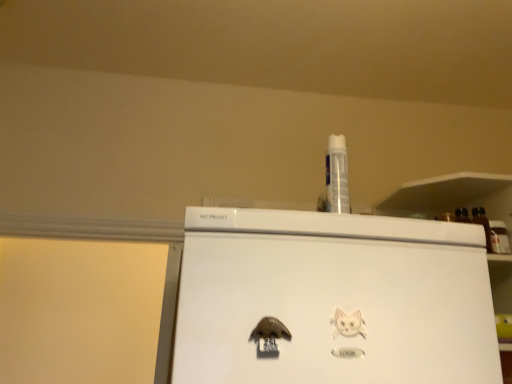
Question: Considering the positions of white paper cat at lower right, which ranks as the 2th animal in left-to-right order, and brown matte magnet at lower center, which is counted as the 1th animal, starting from the left, in the image, is white paper cat at lower right, which ranks as the 2th animal in left-to-right order, wider or thinner than brown matte magnet at lower center, which is counted as the 1th animal, starting from the left,?

Choices:
 (A) thin
 (B) wide

Answer: (A)

Question: Choose the correct answer: Is white paper cat at lower right, which ranks as the 2th animal in left-to-right order, inside brown matte magnet at lower center, which is counted as the 1th animal, starting from the left, or outside it?

Choices:
 (A) outside
 (B) inside

Answer: (A)

Question: Is white paper cat at lower right, which is the first animal from right to left, in front of or behind brown matte magnet at lower center, acting as the second animal starting from the right, in the image?

Choices:
 (A) front
 (B) behind

Answer: (B)

Question: Considering the positions of brown matte magnet at lower center, acting as the second animal starting from the right, and white paper cat at lower right, which ranks as the 2th animal in left-to-right order, in the image, is brown matte magnet at lower center, acting as the second animal starting from the right, wider or thinner than white paper cat at lower right, which ranks as the 2th animal in left-to-right order,?

Choices:
 (A) thin
 (B) wide

Answer: (B)

Question: Does point (258, 324) appear closer or farther from the camera than point (354, 327)?

Choices:
 (A) farther
 (B) closer

Answer: (B)

Question: From the image's perspective, is brown matte magnet at lower center, which is counted as the 1th animal, starting from the left, above or below white paper cat at lower right, which is the first animal from right to left?

Choices:
 (A) below
 (B) above

Answer: (A)

Question: Relative to white paper cat at lower right, which is the first animal from right to left, is brown matte magnet at lower center, acting as the second animal starting from the right, in front or behind?

Choices:
 (A) front
 (B) behind

Answer: (A)